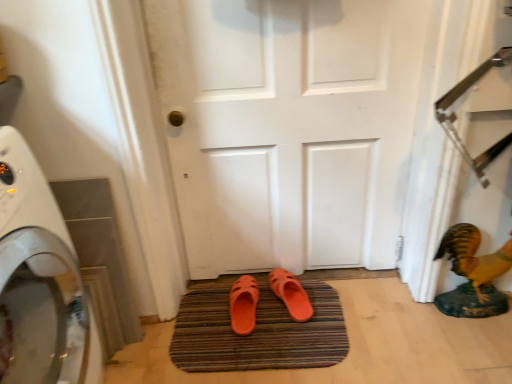
You are a GUI agent. You are given a task and a screenshot of the screen. Output one action in this format:
    pyautogui.click(x=<x>, y=<y>)
    Task: Click on the free space that is to the left of orange rubber slipper at center, the 1th footwear from the left
    The width and height of the screenshot is (512, 384).
    Given the screenshot: What is the action you would take?
    (199, 317)